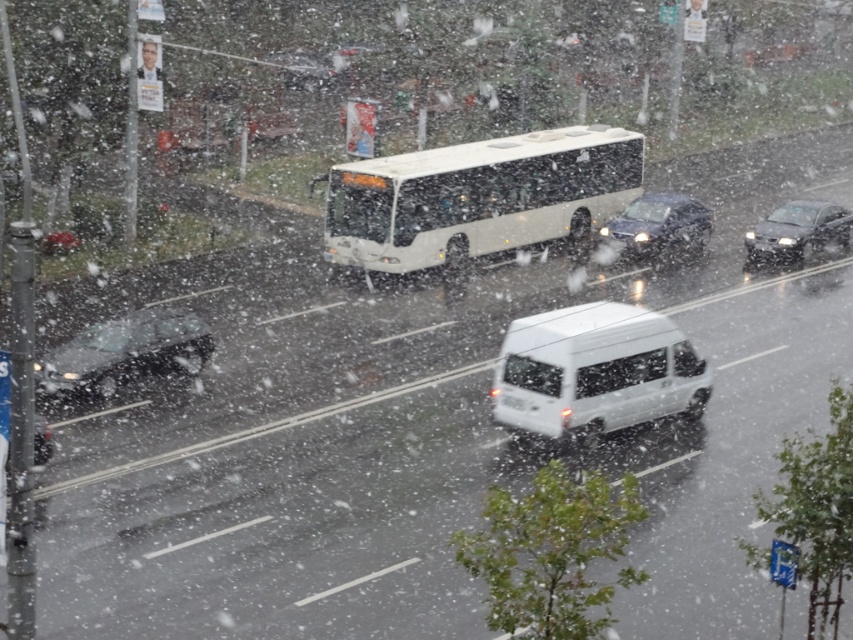
Does glossy black car at lower left appear on the right side of shiny black sedan at right?

Incorrect, glossy black car at lower left is not on the right side of shiny black sedan at right.

In the scene shown: Who is positioned more to the right, glossy black car at lower left or shiny black sedan at right?

Positioned to the right is shiny black sedan at right.

Where is `glossy black car at lower left`? The image size is (853, 640). glossy black car at lower left is located at coordinates (125, 355).

You are a GUI agent. You are given a task and a screenshot of the screen. Output one action in this format:
    pyautogui.click(x=<x>, y=<y>)
    Task: Click on the glossy black car at lower left
    This screenshot has height=640, width=853.
    Given the screenshot: What is the action you would take?
    tap(125, 355)

Is white matte van at center thinner than glossy black car at lower left?

No, white matte van at center is not thinner than glossy black car at lower left.

Can you confirm if white matte van at center is wider than glossy black car at lower left?

Indeed, white matte van at center has a greater width compared to glossy black car at lower left.

Image resolution: width=853 pixels, height=640 pixels. I want to click on white matte van at center, so click(x=595, y=372).

Can you confirm if white matte van at center is thinner than shiny black sedan at right?

No.

Identify the location of white matte van at center. (595, 372).